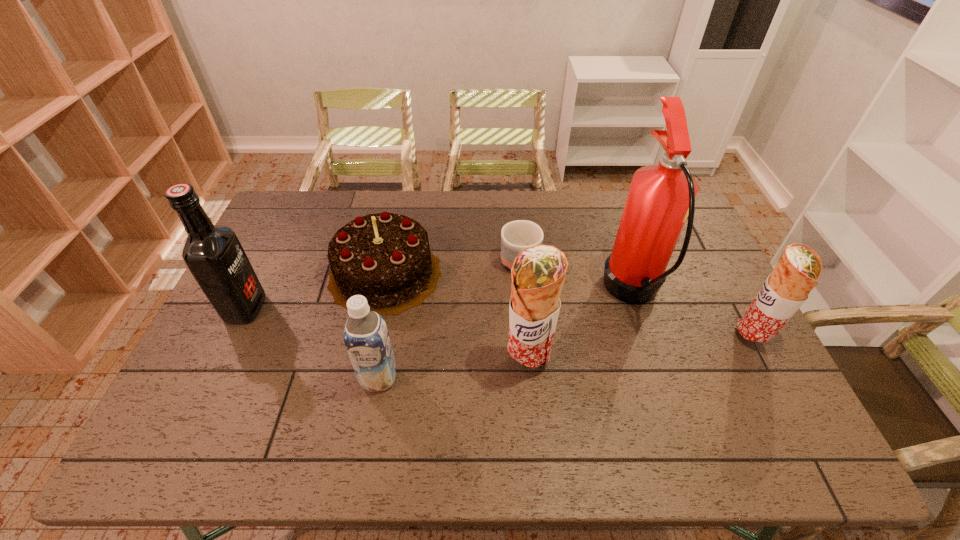
Please point a spot to add another burrito on the left. Please provide its 2D coordinates. Your answer should be formatted as a tuple, i.e. [(x, y)], where the tuple contains the x and y coordinates of a point satisfying the conditions above.

[(279, 389)]